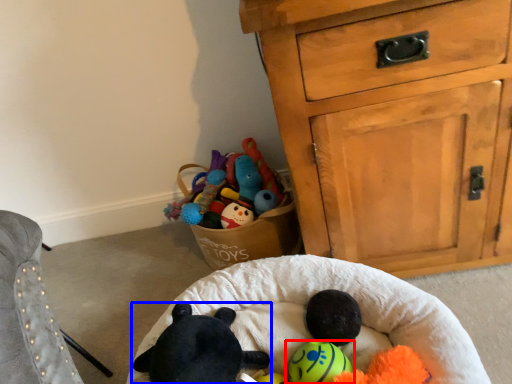
Question: Among these objects, which one is nearest to the camera, toy (highlighted by a red box) or toy (highlighted by a blue box)?

Choices:
 (A) toy
 (B) toy

Answer: (B)